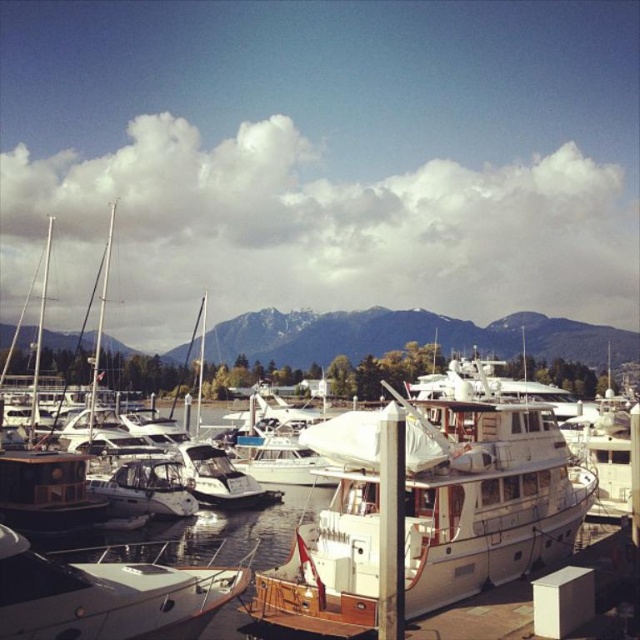
Question: Can you confirm if white wood boat at center is positioned to the right of white glossy boat at lower left?

Choices:
 (A) yes
 (B) no

Answer: (A)

Question: Which of the following is the farthest from the observer?

Choices:
 (A) white wood boat at center
 (B) white glossy boat at lower left

Answer: (A)

Question: Is white wood boat at center closer to the viewer compared to white glossy boat at lower left?

Choices:
 (A) yes
 (B) no

Answer: (B)

Question: Can you confirm if white wood boat at center is smaller than white glossy boat at lower left?

Choices:
 (A) no
 (B) yes

Answer: (A)